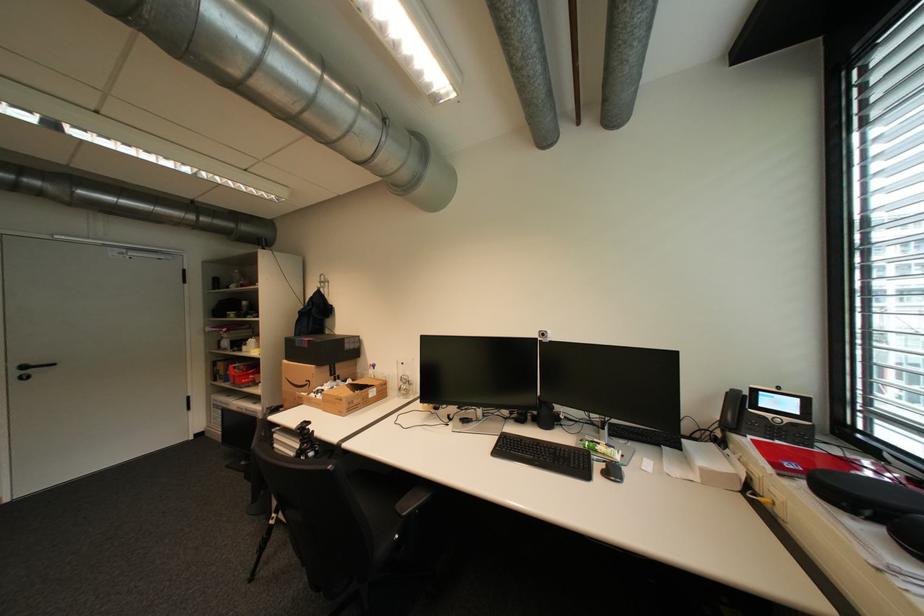
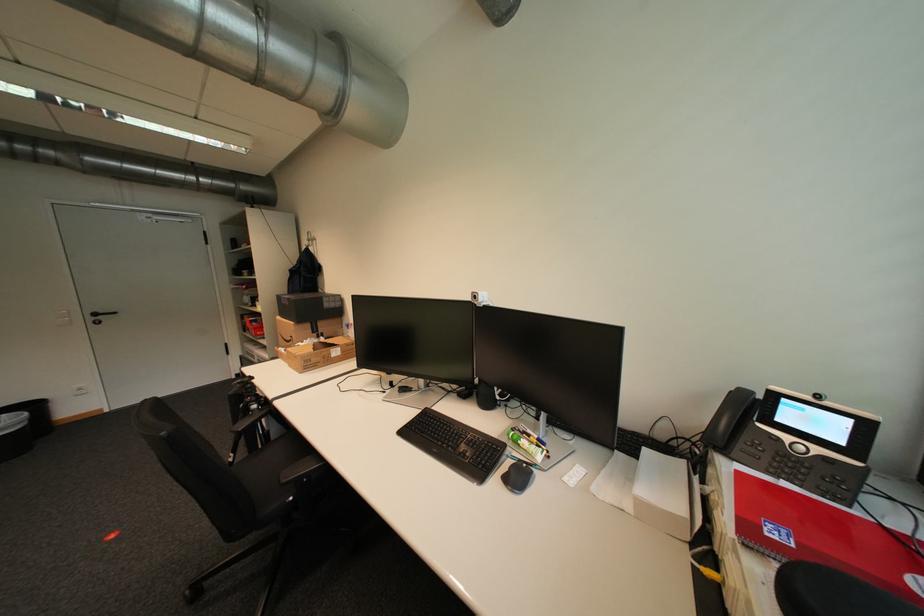
The point at (200, 438) is marked in the first image. Where is the corresponding point in the second image?

(242, 378)